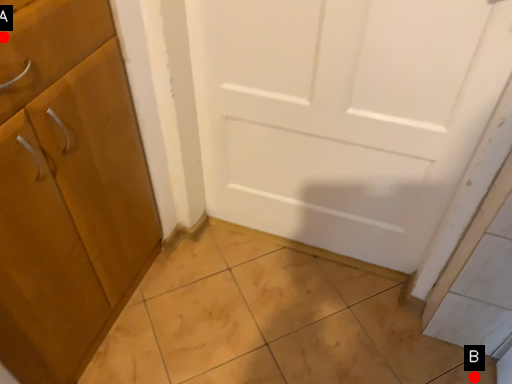
Question: Two points are circled on the image, labeled by A and B beside each circle. Which of the following is the farthest from the observer?

Choices:
 (A) A is further
 (B) B is further

Answer: (B)